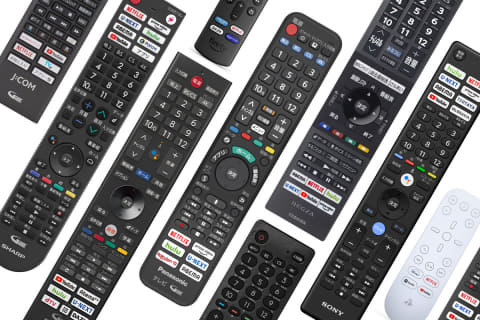
At what (x,y) coordinates should I click in order to perform the action: click on remotes. Please return your answer as a coordinate pair (x, y). The height and width of the screenshot is (320, 480). Looking at the image, I should click on (36, 35), (95, 108), (230, 29), (157, 162), (243, 161), (330, 168), (262, 283), (386, 208), (435, 246), (468, 301).